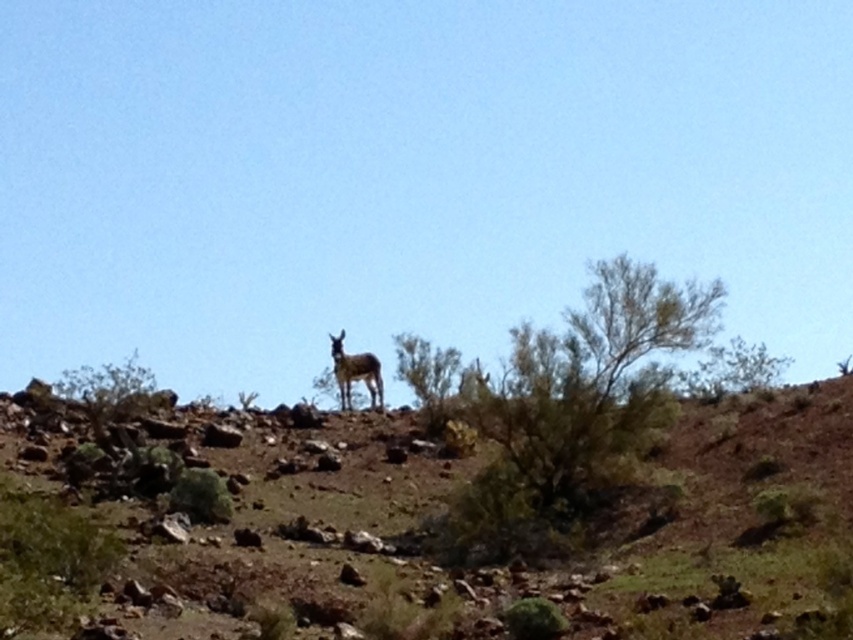
You are navigating a drone over the rugged, arid landscape with sparse vegetation and scattered rocks. You need to land the drone on the brown rocky hillside at center. Based on its coordinates, is the hillside centrally located in the image?

The brown rocky hillside at center is located at point (509, 540), which means it is positioned towards the right side of the image rather than being centrally located. Therefore, the hillside is not centrally located.

You are a hiker trying to spot the brown furry deer at center in the rugged landscape. Since the brown rocky hillside at center is blocking your view, can you see the deer behind it?

The brown rocky hillside at center is closer to the viewer than the brown furry deer at center, so the hillside is blocking the deer from view.

You are a hiker trying to locate both the brown rocky hillside at center and the brown furry deer at center in the image. Which object is positioned lower in the scene?

The brown rocky hillside at center is located below the brown furry deer at center, so it is positioned lower in the scene.